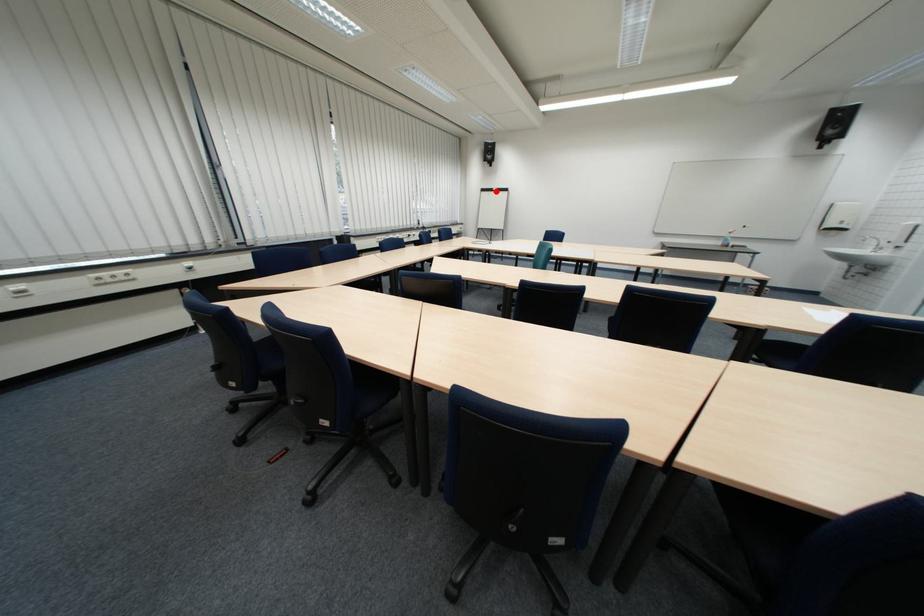
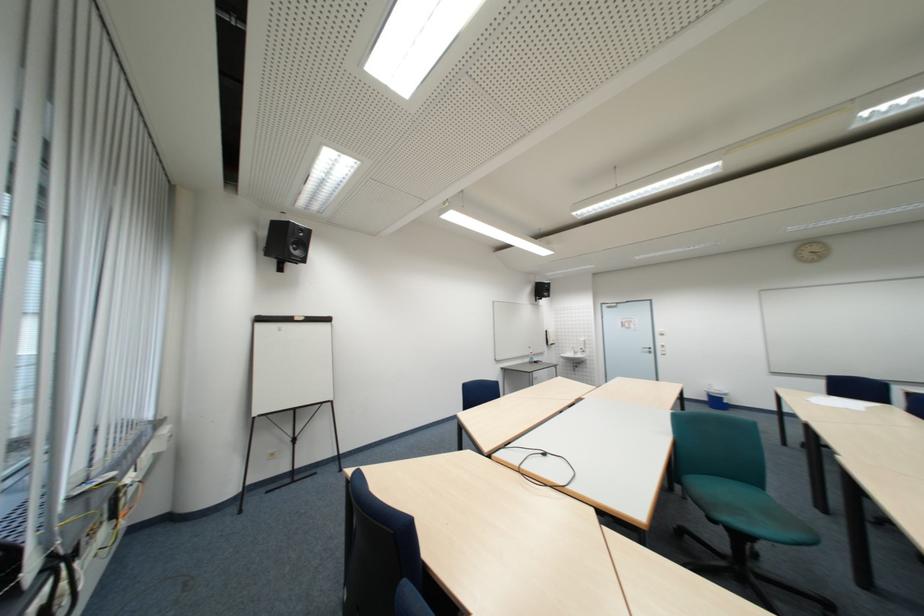
Question: I am providing you with two images of the same scene from different viewpoints. A red point is marked on the first image. At the location where the point appears in image 1, is it still visible in image 2?

Choices:
 (A) Yes
 (B) No

Answer: (A)